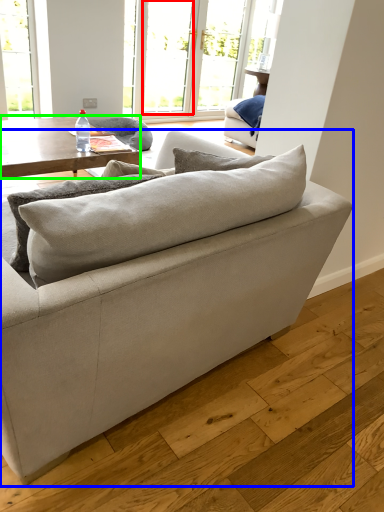
Question: Which is nearer to the window (highlighted by a red box)? studio couch (highlighted by a blue box) or coffee table (highlighted by a green box).

Choices:
 (A) studio couch
 (B) coffee table

Answer: (B)